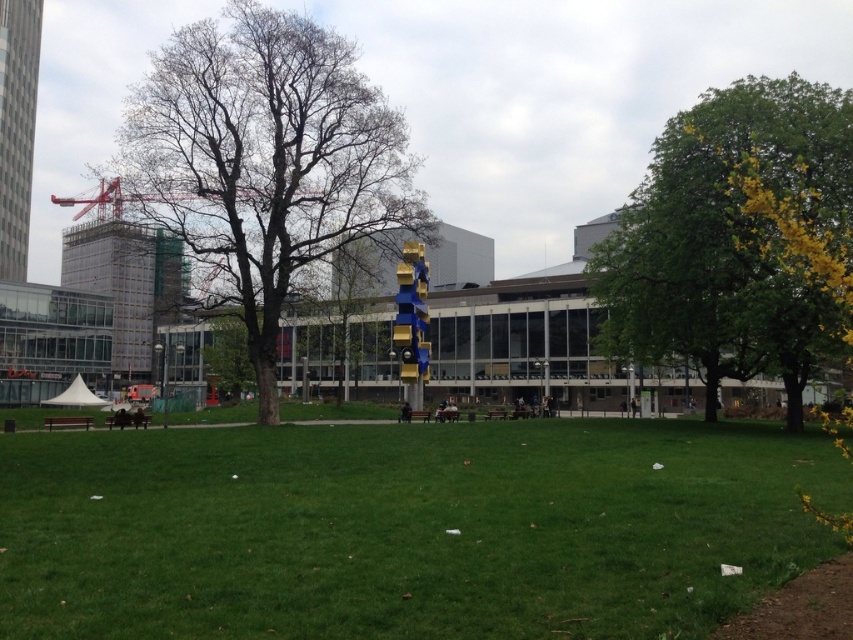
You are a construction worker who needs to move a 30 meter long beam from the red metal crane at upper left to the green leafy tree at right. Can you safely transport the beam horizontally without bending it? Please explain your reasoning.

The distance between the red metal crane at upper left and the green leafy tree at right is 30.87 meters. Since the beam is 30 meters long, there is an 87 cm gap between them. Therefore, the beam cannot reach the green leafy tree at right from the red metal crane at upper left without bending or extending it.

You are standing in the urban park and want to take a photo of the green grass at center and the bare wood tree at center. Which object should you focus on first to ensure both are in sharp focus?

Since the green grass at center is closer to the viewer than the bare wood tree at center, you should focus on the bare wood tree at center first. This way, the depth of field will naturally cover the closer green grass at center as well.

You are a city planner assessing the park layout. You notice the green leafy tree at right and the red metal crane at upper left. Which object is closer to the foreground of the image?

The green leafy tree at right is closer to the foreground because it is positioned under the red metal crane at upper left, indicating it is in front of the crane.